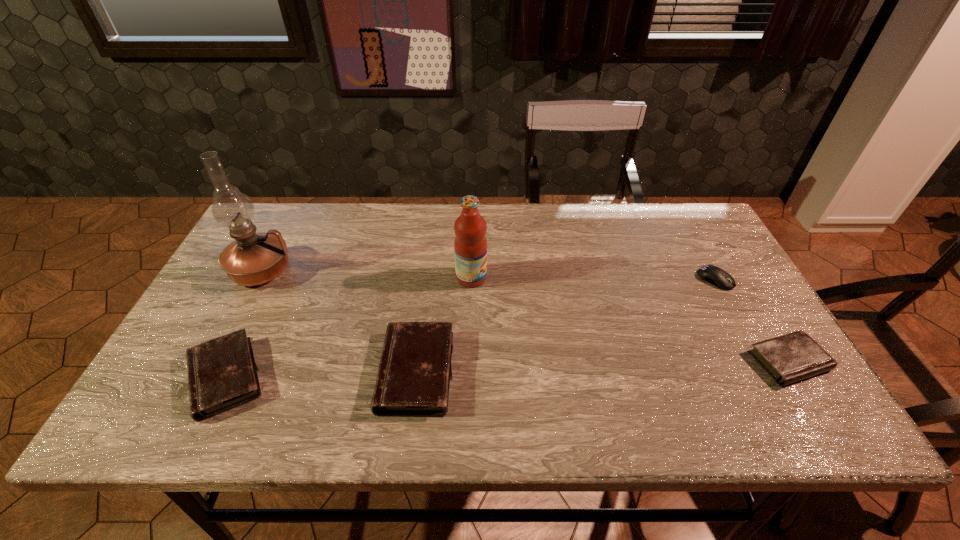
You are a GUI agent. You are given a task and a screenshot of the screen. Output one action in this format:
    pyautogui.click(x=<x>, y=<y>)
    Task: Click on the free space for an extra diary to achieve even spacing
    This screenshot has width=960, height=540.
    Given the screenshot: What is the action you would take?
    pyautogui.click(x=605, y=367)